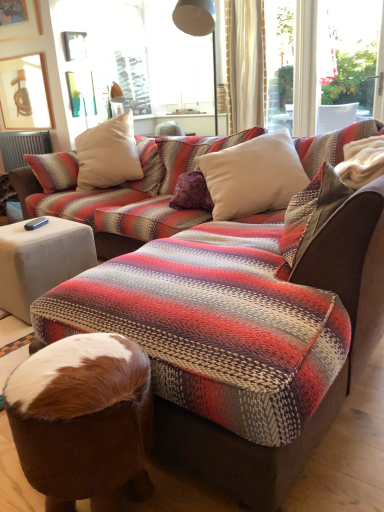
Question: Considering the relative positions of white soft cushion at center, acting as the 1th pillow starting from the back, and white fabric side table at lower left in the image provided, is white soft cushion at center, acting as the 1th pillow starting from the back, to the right of white fabric side table at lower left from the viewer's perspective?

Choices:
 (A) yes
 (B) no

Answer: (A)

Question: Is white soft cushion at center, acting as the 1th pillow starting from the back, far away from white fabric side table at lower left?

Choices:
 (A) yes
 (B) no

Answer: (B)

Question: Considering the relative sizes of white soft cushion at center, acting as the 1th pillow starting from the back, and white fabric side table at lower left in the image provided, is white soft cushion at center, acting as the 1th pillow starting from the back, taller than white fabric side table at lower left?

Choices:
 (A) no
 (B) yes

Answer: (B)

Question: Is white soft cushion at center, acting as the 1th pillow starting from the back, shorter than white fabric side table at lower left?

Choices:
 (A) yes
 (B) no

Answer: (B)

Question: Is white soft cushion at center, the second pillow when ordered from front to back, oriented towards white fabric side table at lower left?

Choices:
 (A) yes
 (B) no

Answer: (B)

Question: From the image's perspective, does white soft cushion at center, acting as the 1th pillow starting from the back, appear higher than white fabric side table at lower left?

Choices:
 (A) yes
 (B) no

Answer: (A)

Question: Considering the relative sizes of brown fur bean bag chair at lower center and white soft cushion at center, the second pillow when ordered from front to back, in the image provided, is brown fur bean bag chair at lower center smaller than white soft cushion at center, the second pillow when ordered from front to back,?

Choices:
 (A) yes
 (B) no

Answer: (A)

Question: From the image's perspective, would you say brown fur bean bag chair at lower center is positioned over white soft cushion at center, acting as the 1th pillow starting from the back?

Choices:
 (A) no
 (B) yes

Answer: (A)

Question: Can you confirm if brown fur bean bag chair at lower center is positioned to the left of white soft cushion at center, the second pillow when ordered from front to back?

Choices:
 (A) yes
 (B) no

Answer: (A)

Question: Does brown fur bean bag chair at lower center come in front of white soft cushion at center, acting as the 1th pillow starting from the back?

Choices:
 (A) no
 (B) yes

Answer: (B)

Question: From a real-world perspective, is brown fur bean bag chair at lower center on white soft cushion at center, acting as the 1th pillow starting from the back?

Choices:
 (A) yes
 (B) no

Answer: (B)

Question: Is brown fur bean bag chair at lower center at the right side of white soft cushion at center, acting as the 1th pillow starting from the back?

Choices:
 (A) yes
 (B) no

Answer: (B)

Question: Does white fabric side table at lower left lie behind brown fur bean bag chair at lower center?

Choices:
 (A) yes
 (B) no

Answer: (A)